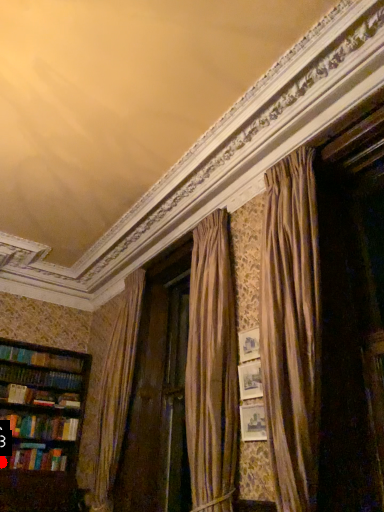
Question: Two points are circled on the image, labeled by A and B beside each circle. Which point is closer to the camera?

Choices:
 (A) A is closer
 (B) B is closer

Answer: (B)